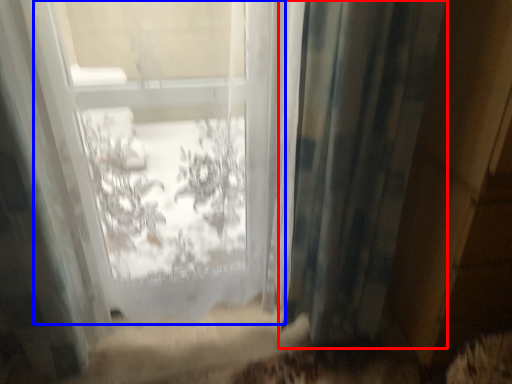
Question: Which object is further to the camera taking this photo, curtain (highlighted by a red box) or bay window (highlighted by a blue box)?

Choices:
 (A) curtain
 (B) bay window

Answer: (A)